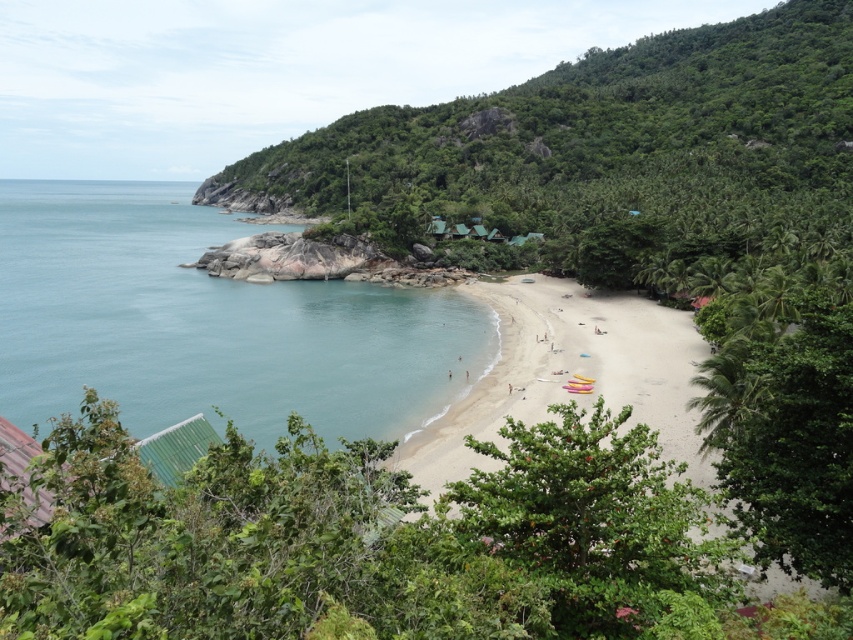
You are standing at the center of the beach and see the point marked at coordinates (209,323). What is located at that point?

The point at coordinates (209,323) is occupied by clear blue water at lower left.

You are standing at the beach and want to walk towards the ocean. There are two points marked on the map as point (x=329, y=468) and point (x=247, y=291). Which point should you head towards to reach the ocean first?

Point (x=329, y=468) is in front of point (x=247, y=291), so you should head towards point (x=329, y=468) to reach the ocean first.

Based on the photo, you are standing at the point marked by coordinates point (x=376, y=544). Describe what you see immediately around you.

You are standing at point (x=376, y=544), which is a green leafy bush at center.